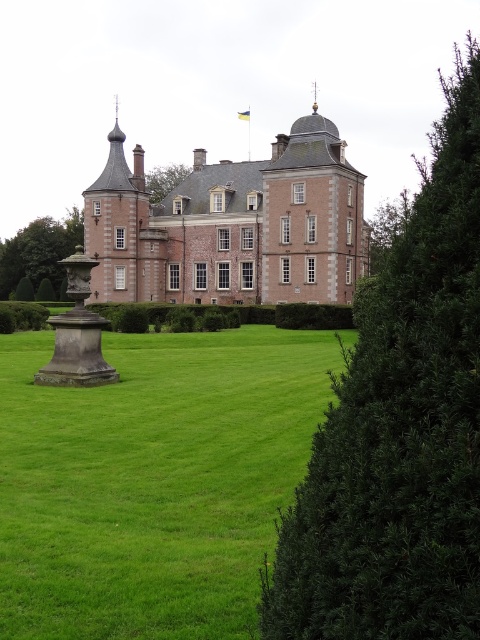
Who is higher up, brick stone castle at center or green leafy tree at upper center?

green leafy tree at upper center is above.

Does brick stone castle at center have a greater width compared to green leafy tree at upper center?

Correct, the width of brick stone castle at center exceeds that of green leafy tree at upper center.

Which is in front, point (263, 170) or point (169, 172)?

Point (263, 170)

This screenshot has width=480, height=640. What are the coordinates of `brick stone castle at center` in the screenshot? It's located at (231, 225).

Does point (470, 508) lie in front of point (44, 320)?

Yes, point (470, 508) is in front of point (44, 320).

Is green leafy bush at right further to the viewer compared to green leafy hedge at left?

No, it is not.

Is point (372, 458) closer to camera compared to point (12, 324)?

Yes, point (372, 458) is in front of point (12, 324).

What are the coordinates of `green leafy bush at right` in the screenshot? It's located at (399, 428).

Identify the location of green leafy tree at left. Image resolution: width=480 pixels, height=640 pixels. (38, 252).

This screenshot has width=480, height=640. Describe the element at coordinates (38, 252) in the screenshot. I see `green leafy tree at left` at that location.

Is point (66, 250) closer to viewer compared to point (20, 307)?

No, it is not.

Find the location of `green leafy tree at left`. green leafy tree at left is located at coordinates (38, 252).